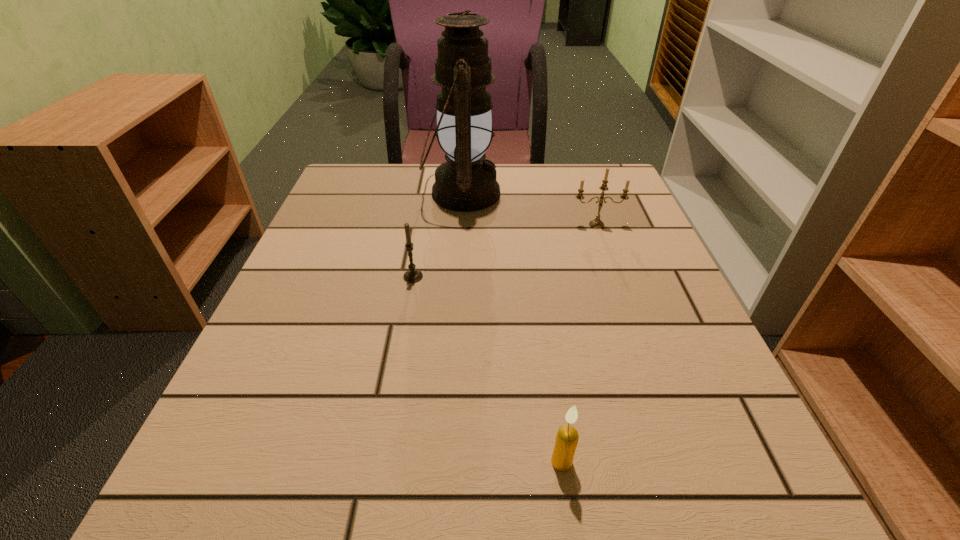
Find the location of a particular element. This screenshot has height=540, width=960. blank space at the far right corner of the desktop is located at coordinates (575, 210).

Find the location of `blank region between the tallest object and the second farthest candle`. blank region between the tallest object and the second farthest candle is located at coordinates (438, 235).

The image size is (960, 540). I want to click on free space between the oil lamp and the nearest candle, so click(512, 327).

Where is `vacant point located between the farthest candle and the leftmost candle`? The width and height of the screenshot is (960, 540). vacant point located between the farthest candle and the leftmost candle is located at coordinates (505, 251).

Where is `free spot between the second farthest candle and the rightmost object`? free spot between the second farthest candle and the rightmost object is located at coordinates (505, 251).

Find the location of a particular element. free space between the farthest candle and the oil lamp is located at coordinates (529, 209).

Where is `free space between the farthest candle and the tallest object`? free space between the farthest candle and the tallest object is located at coordinates click(529, 209).

Find the location of a particular element. free point between the leftmost candle and the tallest object is located at coordinates (438, 235).

Where is `vacant space that's between the tallest object and the farthest candle`? Image resolution: width=960 pixels, height=540 pixels. vacant space that's between the tallest object and the farthest candle is located at coordinates (529, 209).

The width and height of the screenshot is (960, 540). What are the coordinates of `empty space that is in between the tallest object and the second farthest candle` in the screenshot? It's located at (438, 235).